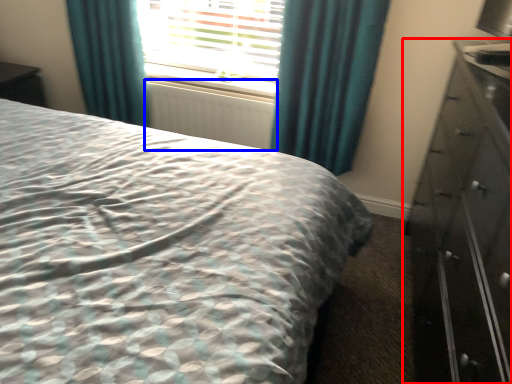
Question: Which of the following is the farthest to the observer, chest of drawers (highlighted by a red box) or radiator (highlighted by a blue box)?

Choices:
 (A) chest of drawers
 (B) radiator

Answer: (B)